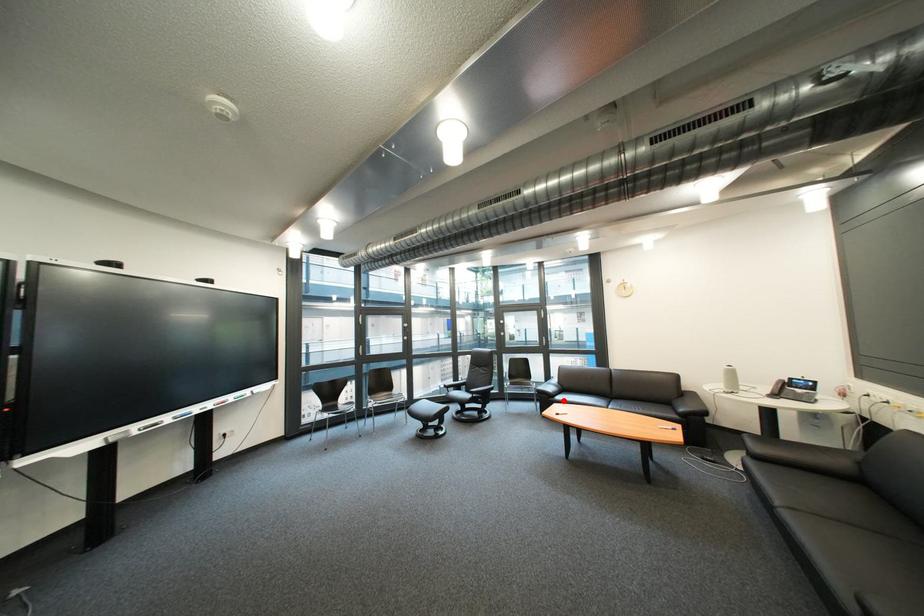
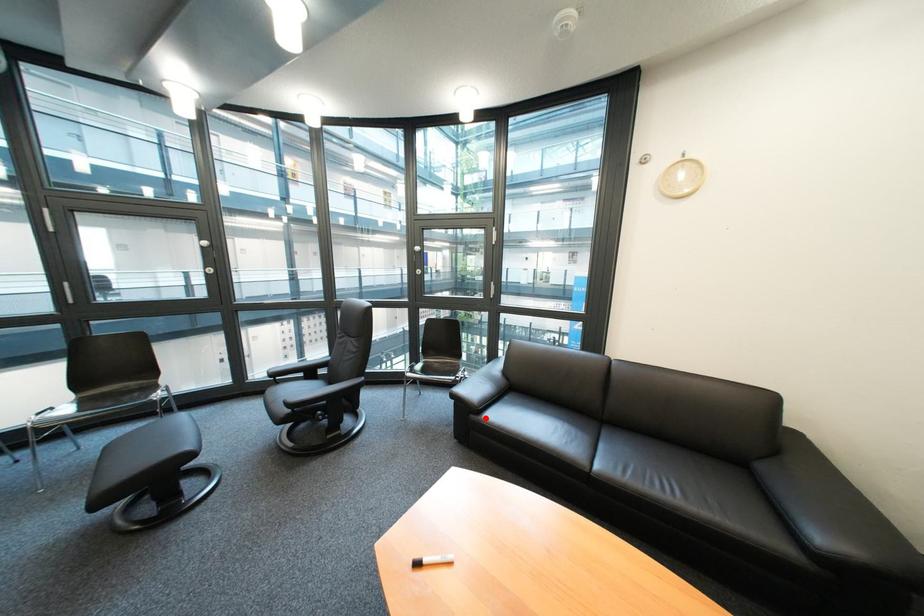
I am providing you with two images of the same scene from different viewpoints. A red point is marked on the first image and another point is marked on the second image. Do the highlighted points in image1 and image2 indicate the same real-world spot?

Yes